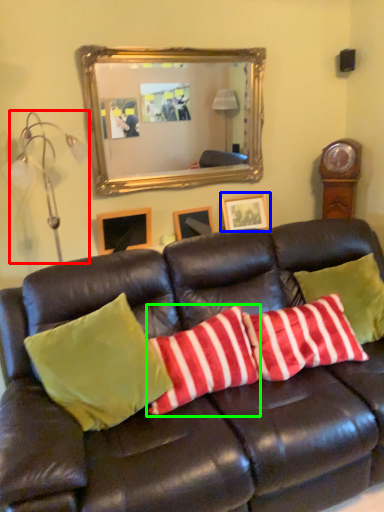
Question: Which object is the closest to the lamp (highlighted by a red box)? Choose among these: picture frame (highlighted by a blue box) or pillow (highlighted by a green box).

Choices:
 (A) picture frame
 (B) pillow

Answer: (A)